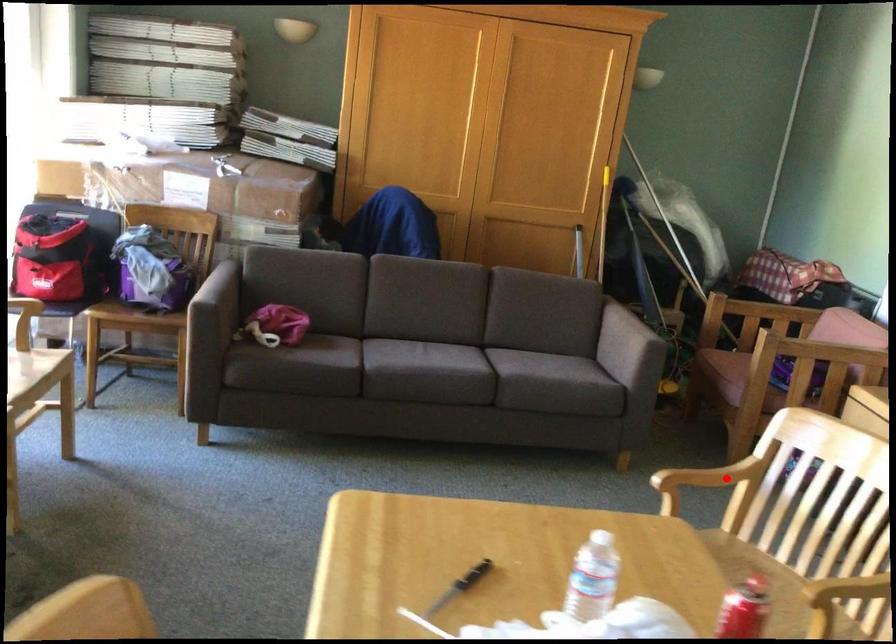
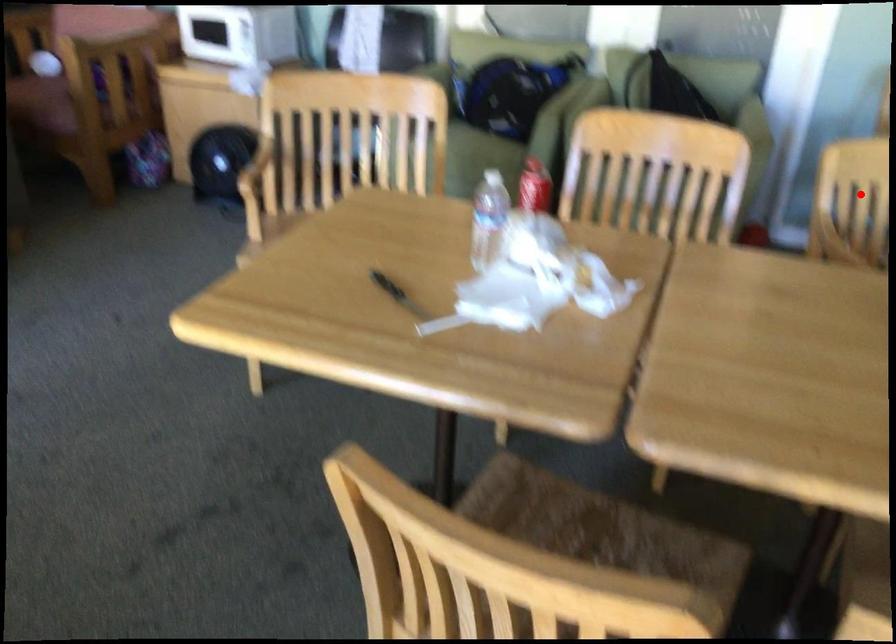
I am providing you with two images of the same scene from different viewpoints. A red point is marked on the first image and another point is marked on the second image. Does the point marked in image1 correspond to the same location as the one in image2?

No